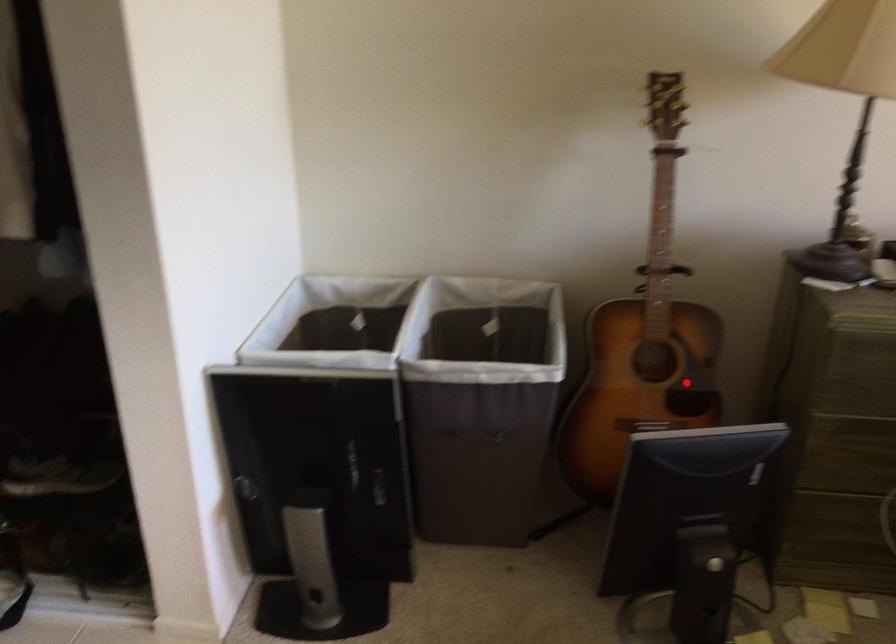
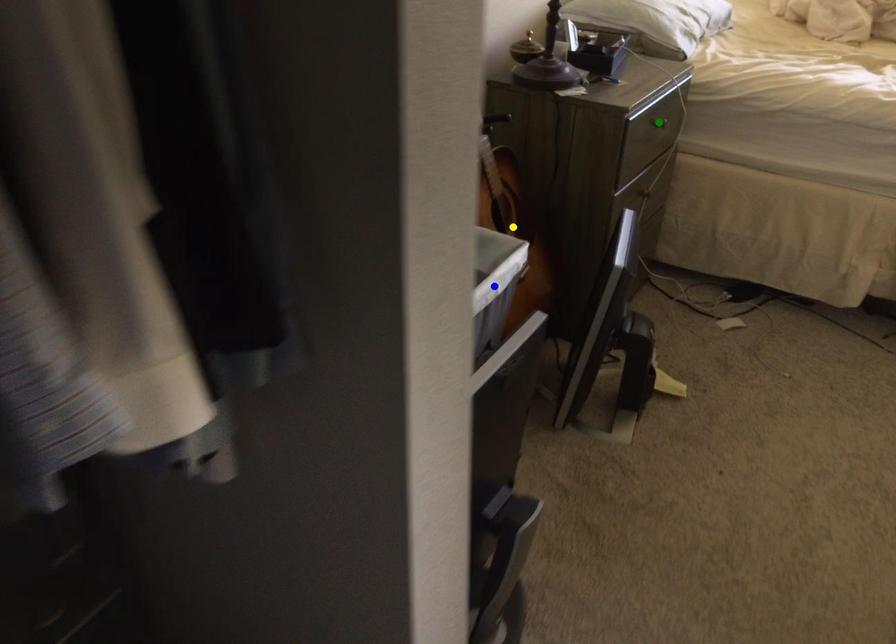
Question: I am providing you with two images of the same scene from different viewpoints. A red point is marked on the first image. You are given multiple points on the second image. Which spot in image 2 lines up with the point in image 1?

Choices:
 (A) green point
 (B) blue point
 (C) yellow point

Answer: (C)